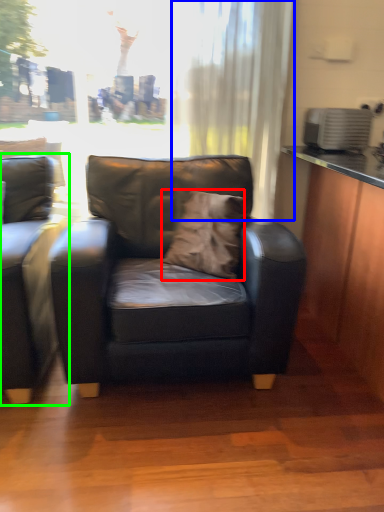
Question: Based on their relative distances, which object is nearer to pillow (highlighted by a red box)? Choose from curtain (highlighted by a blue box) and studio couch (highlighted by a green box).

Choices:
 (A) curtain
 (B) studio couch

Answer: (B)